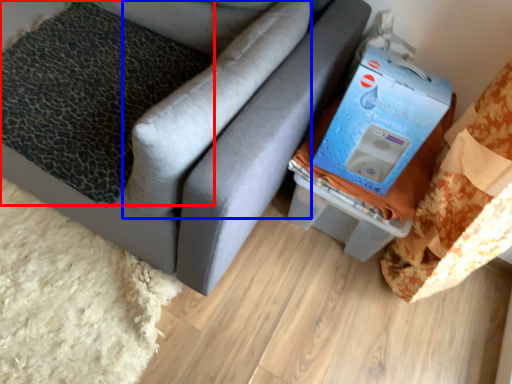
Question: Among these objects, which one is nearest to the camera, pillow (highlighted by a red box) or pillow (highlighted by a blue box)?

Choices:
 (A) pillow
 (B) pillow

Answer: (B)